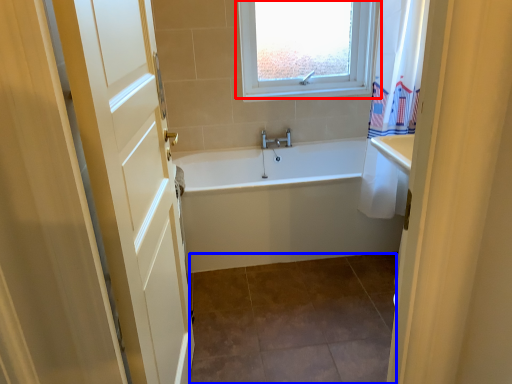
Question: Which point is closer to the camera, window (highlighted by a red box) or tile (highlighted by a blue box)?

Choices:
 (A) window
 (B) tile

Answer: (B)